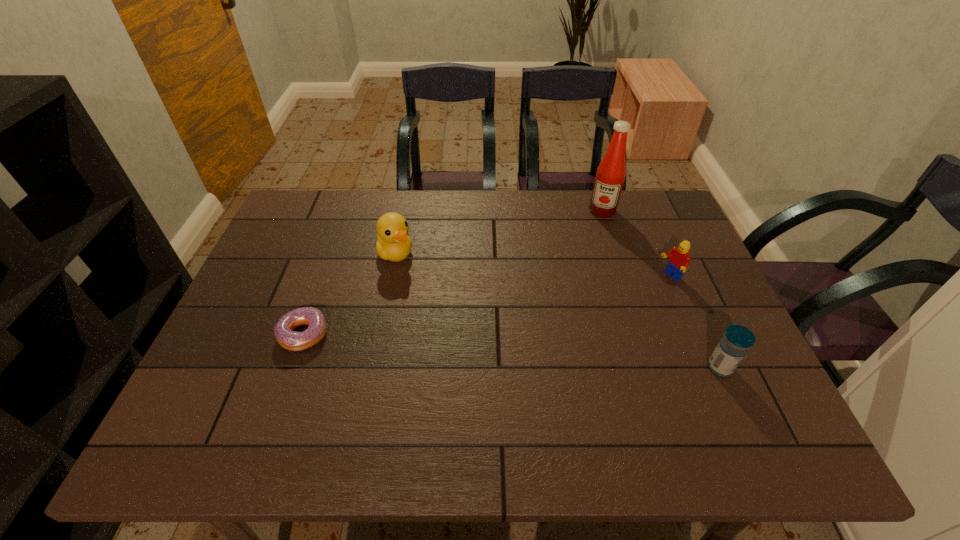
What are the coordinates of `doughnut` in the screenshot? It's located at (x=294, y=341).

Locate an element on the screen. Image resolution: width=960 pixels, height=540 pixels. the leftmost object is located at coordinates (294, 341).

I want to click on medicine, so click(733, 346).

Identify the location of the second object from left to right. This screenshot has height=540, width=960. (393, 244).

Locate an element on the screen. the second tallest object is located at coordinates (393, 244).

Locate an element on the screen. Lego is located at coordinates (679, 260).

The image size is (960, 540). What are the coordinates of `condiment` in the screenshot? It's located at (611, 172).

Image resolution: width=960 pixels, height=540 pixels. In order to click on the tallest object in this screenshot , I will do `click(611, 172)`.

You are a GUI agent. You are given a task and a screenshot of the screen. Output one action in this format:
    pyautogui.click(x=<x>, y=<y>)
    Task: Click on the vacant space located on the left of the shortest object
    The width and height of the screenshot is (960, 540).
    Given the screenshot: What is the action you would take?
    pyautogui.click(x=252, y=334)

Identify the location of free spot located on the right of the nearest object. (755, 367).